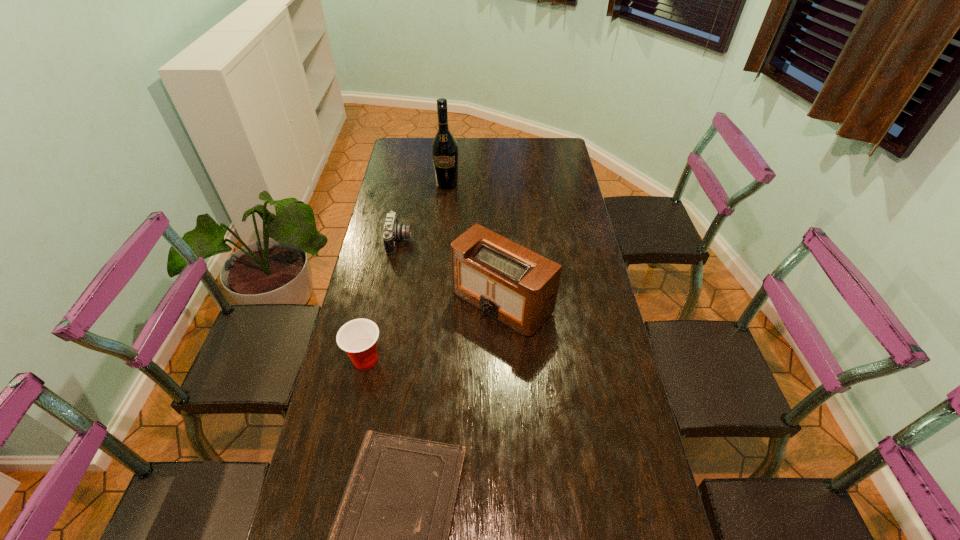
At what (x,y) coordinates should I click in order to perform the action: click on free space located on the right of the third shortest object. Please return your answer as a coordinate pair (x, y). This screenshot has width=960, height=540. Looking at the image, I should click on tap(436, 360).

At what (x,y) coordinates should I click in order to perform the action: click on vacant area situated 0.280m on the front-facing side of the camera. Please return your answer as a coordinate pair (x, y). The image size is (960, 540). Looking at the image, I should click on point(485,241).

This screenshot has width=960, height=540. I want to click on cup present at the left edge, so click(358, 338).

Find the location of a particular element. The width and height of the screenshot is (960, 540). camera located in the left edge section of the desktop is located at coordinates (393, 231).

At what (x,y) coordinates should I click in order to perform the action: click on blank space at the far edge of the desktop. Please return your answer as a coordinate pair (x, y). The height and width of the screenshot is (540, 960). Looking at the image, I should click on pos(502,141).

In the image, there is a desktop. Identify the location of blank space at the left edge. (411, 166).

In the image, there is a desktop. Identify the location of blank space at the right edge. The height and width of the screenshot is (540, 960). (620, 366).

You are a GUI agent. You are given a task and a screenshot of the screen. Output one action in this format:
    pyautogui.click(x=<x>, y=<y>)
    Task: Click on the free space at the far left corner
    The image size is (960, 540).
    Given the screenshot: What is the action you would take?
    pyautogui.click(x=416, y=151)

The image size is (960, 540). I want to click on vacant area at the far right corner, so click(563, 141).

The image size is (960, 540). I want to click on unoccupied area between the fourth farthest object and the second shortest object, so pos(383,300).